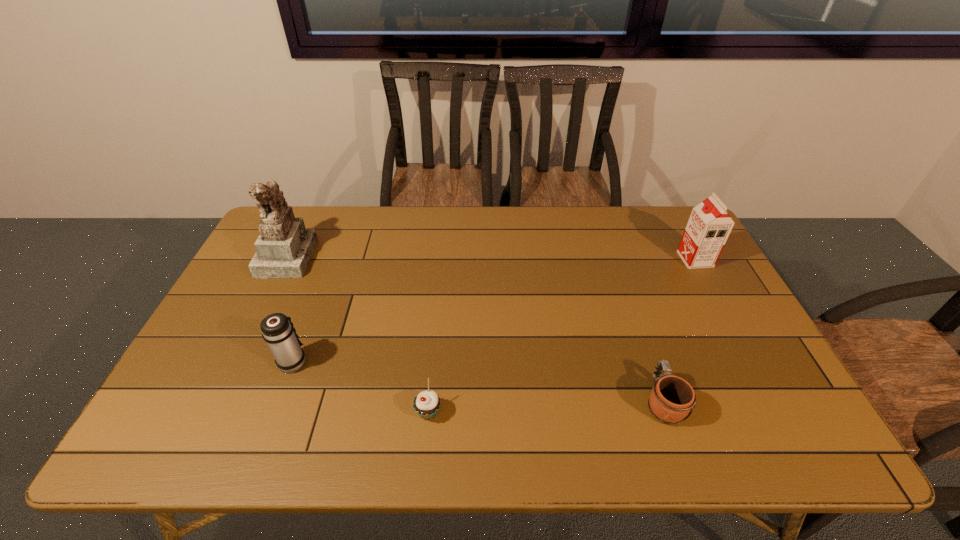
Where is `free spot that satisfies the following two spatial constraints: 1. on the front-facing side of the rightmost object; 2. on the left side of the tallest object`? free spot that satisfies the following two spatial constraints: 1. on the front-facing side of the rightmost object; 2. on the left side of the tallest object is located at coordinates (286, 259).

Identify the location of vacant space that satisfies the following two spatial constraints: 1. on the back side of the soya milk; 2. on the front-facing side of the leftmost object. The width and height of the screenshot is (960, 540). (693, 256).

The width and height of the screenshot is (960, 540). In order to click on free space that satisfies the following two spatial constraints: 1. on the front-facing side of the third object from right to left; 2. on the right side of the leftmost object in this screenshot , I will do `click(210, 413)`.

Where is `free location that satisfies the following two spatial constraints: 1. on the front-facing side of the tallest object; 2. on the side with the handle of the third nearest object`? The image size is (960, 540). free location that satisfies the following two spatial constraints: 1. on the front-facing side of the tallest object; 2. on the side with the handle of the third nearest object is located at coordinates (236, 361).

I want to click on free space in the image that satisfies the following two spatial constraints: 1. on the side of the second object from right to left with the handle; 2. on the front-facing side of the tallest object, so click(613, 256).

Identify the location of blank area in the image that satisfies the following two spatial constraints: 1. on the front-facing side of the leftmost object; 2. on the back side of the third object from right to left. This screenshot has width=960, height=540. (210, 413).

At what (x,y) coordinates should I click in order to perform the action: click on free space that satisfies the following two spatial constraints: 1. on the front-facing side of the tallest object; 2. on the side of the fourth object from left to right with the handle. Please return your answer as a coordinate pair (x, y). This screenshot has height=540, width=960. Looking at the image, I should click on (216, 401).